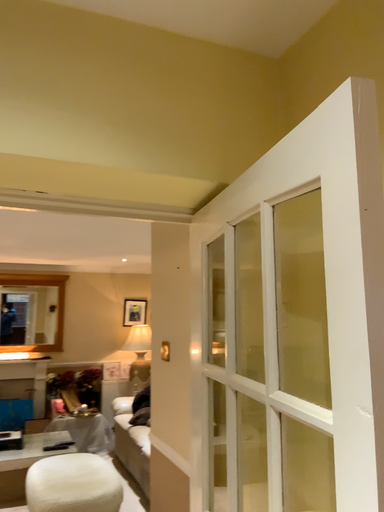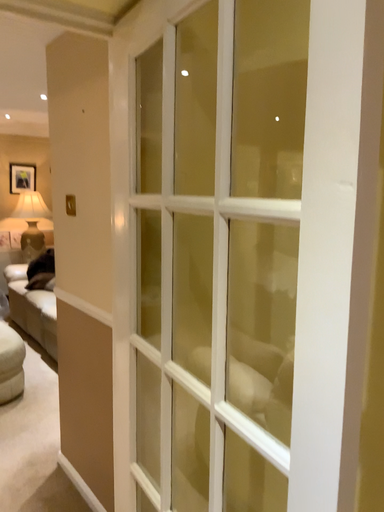
Question: How did the camera likely rotate when shooting the video?

Choices:
 (A) rotated right
 (B) rotated left

Answer: (A)